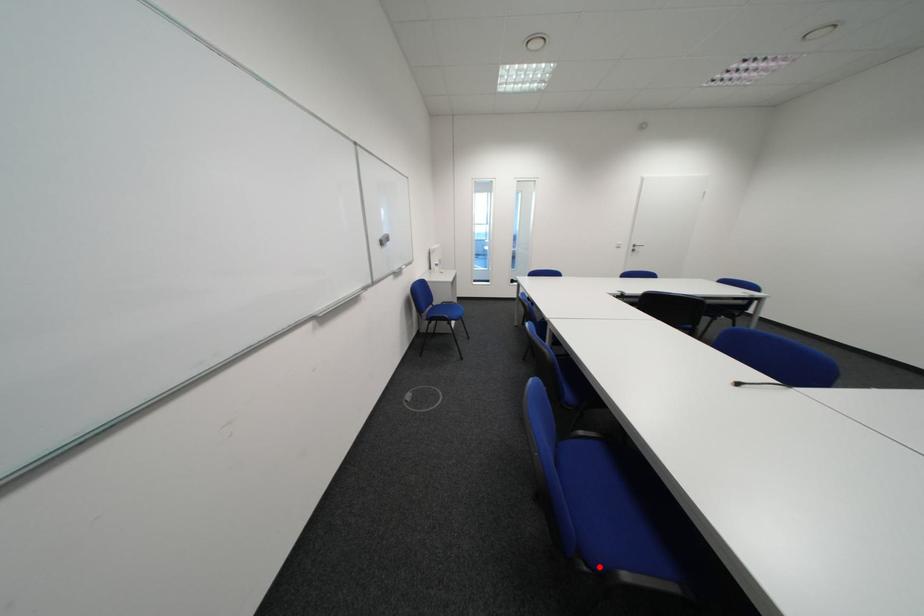
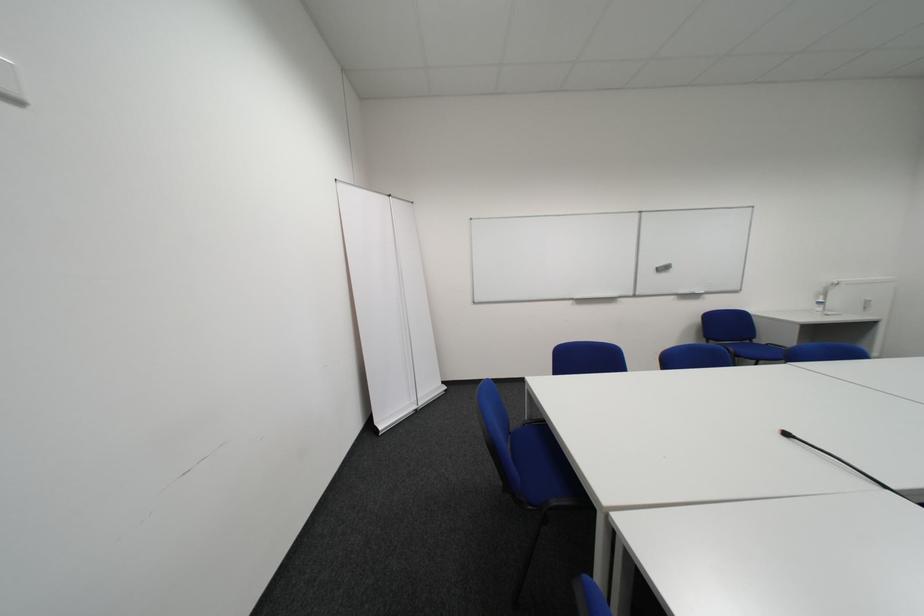
Question: I am providing you with two images of the same scene from different viewpoints. A red point is marked on the first image. At the location where the point appears in image 1, is it still visible in image 2?

Choices:
 (A) Yes
 (B) No

Answer: (B)